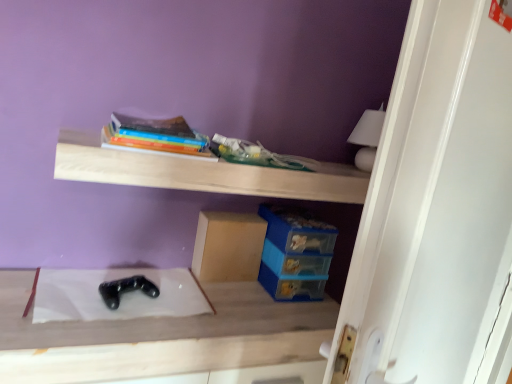
Question: Considering the relative sizes of wooden shelf at upper center and black matte game controller at center in the image provided, is wooden shelf at upper center taller than black matte game controller at center?

Choices:
 (A) no
 (B) yes

Answer: (A)

Question: Is the depth of wooden shelf at upper center less than that of black matte game controller at center?

Choices:
 (A) no
 (B) yes

Answer: (A)

Question: Can black matte game controller at center be found inside wooden shelf at upper center?

Choices:
 (A) no
 (B) yes

Answer: (A)

Question: Is wooden shelf at upper center not inside black matte game controller at center?

Choices:
 (A) no
 (B) yes

Answer: (B)

Question: From a real-world perspective, is wooden shelf at upper center physically below black matte game controller at center?

Choices:
 (A) yes
 (B) no

Answer: (B)

Question: From the image's perspective, is wooden shelf at upper center above or below black matte game controller at lower center?

Choices:
 (A) above
 (B) below

Answer: (A)

Question: Looking at their shapes, would you say wooden shelf at upper center is wider or thinner than black matte game controller at lower center?

Choices:
 (A) thin
 (B) wide

Answer: (B)

Question: Is point (148, 170) closer or farther from the camera than point (108, 306)?

Choices:
 (A) farther
 (B) closer

Answer: (B)

Question: In the image, is wooden shelf at upper center positioned in front of or behind black matte game controller at lower center?

Choices:
 (A) behind
 (B) front

Answer: (B)

Question: Considering the positions of black matte game controller at lower center and black matte game controller at center in the image, is black matte game controller at lower center bigger or smaller than black matte game controller at center?

Choices:
 (A) big
 (B) small

Answer: (B)

Question: Is black matte game controller at lower center in front of or behind black matte game controller at center in the image?

Choices:
 (A) behind
 (B) front

Answer: (A)

Question: Considering the positions of black matte game controller at lower center and black matte game controller at center in the image, is black matte game controller at lower center wider or thinner than black matte game controller at center?

Choices:
 (A) thin
 (B) wide

Answer: (A)

Question: In the image, is black matte game controller at lower center on the left side or the right side of black matte game controller at center?

Choices:
 (A) right
 (B) left

Answer: (B)

Question: From the image's perspective, is wooden shelf at upper center positioned above or below hardcover book at upper center?

Choices:
 (A) above
 (B) below

Answer: (B)

Question: Visually, is wooden shelf at upper center positioned to the left or to the right of hardcover book at upper center?

Choices:
 (A) left
 (B) right

Answer: (B)